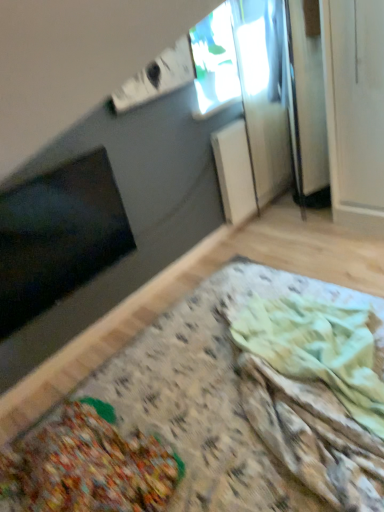
Question: From the image's perspective, is black matte window screen at lower left above or below wooden table at lower left?

Choices:
 (A) above
 (B) below

Answer: (A)

Question: From a real-world perspective, is black matte window screen at lower left above or below wooden table at lower left?

Choices:
 (A) below
 (B) above

Answer: (B)

Question: Based on their relative distances, which object is nearer to the transparent glass window at upper center?

Choices:
 (A) textured fabric blanket at lower center
 (B) wooden table at lower left
 (C) black matte window screen at lower left

Answer: (C)

Question: Which of these objects is positioned closest to the wooden table at lower left?

Choices:
 (A) textured fabric blanket at lower center
 (B) black matte window screen at lower left
 (C) transparent glass window at upper center

Answer: (A)